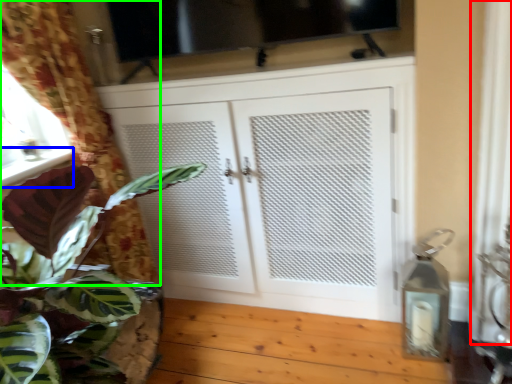
Question: Which object is the closest to the curtain (highlighted by a red box)? Choose among these: window sill (highlighted by a blue box) or curtain (highlighted by a green box).

Choices:
 (A) window sill
 (B) curtain

Answer: (B)